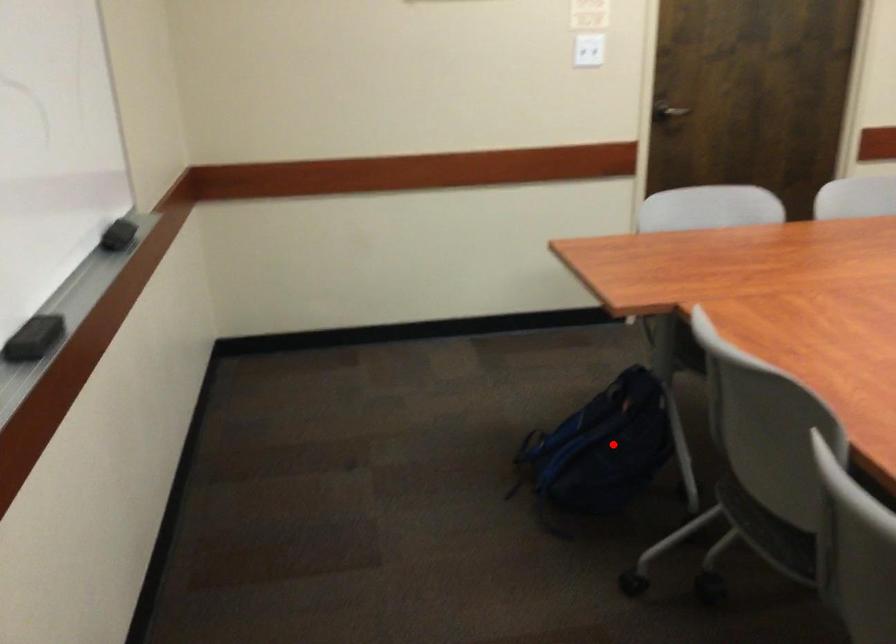
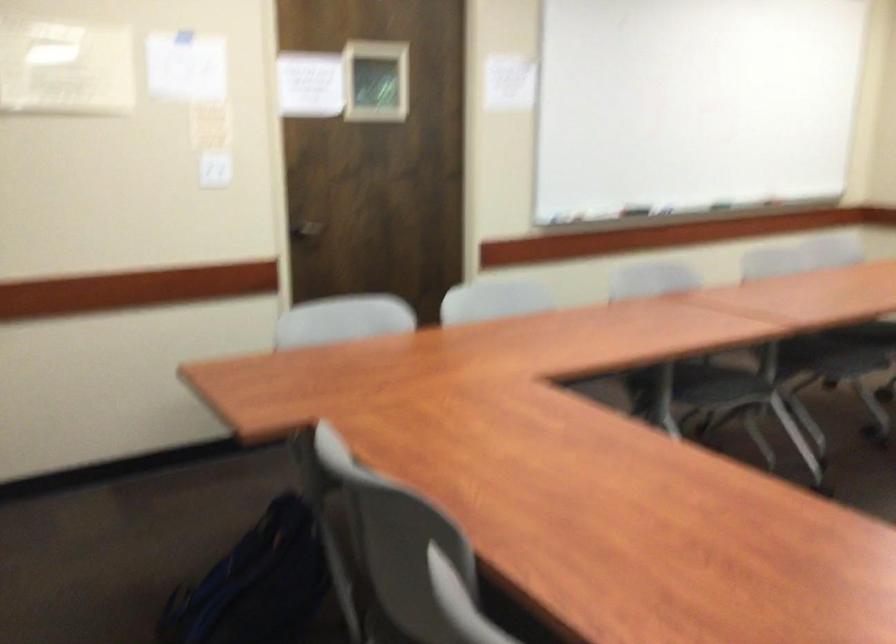
The point at the highlighted location is marked in the first image. Where is the corresponding point in the second image?

(254, 583)